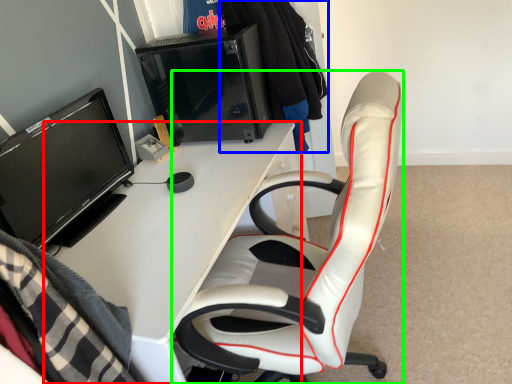
Question: Considering the real-world distances, which object is farthest from desk (highlighted by a red box)? clothing (highlighted by a blue box) or chair (highlighted by a green box)?

Choices:
 (A) clothing
 (B) chair

Answer: (A)